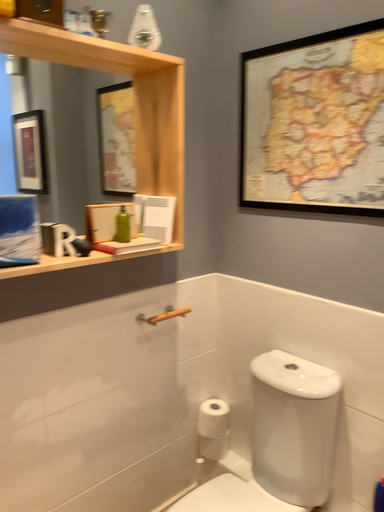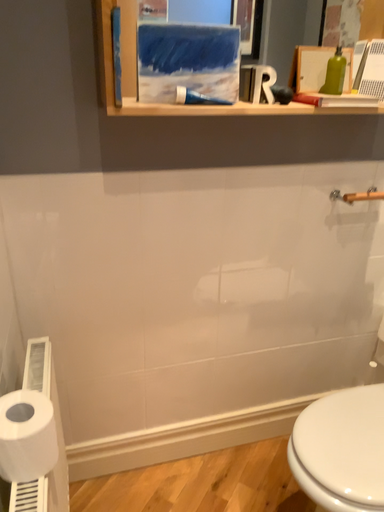
Question: How did the camera likely rotate when shooting the video?

Choices:
 (A) rotated right
 (B) rotated left

Answer: (B)